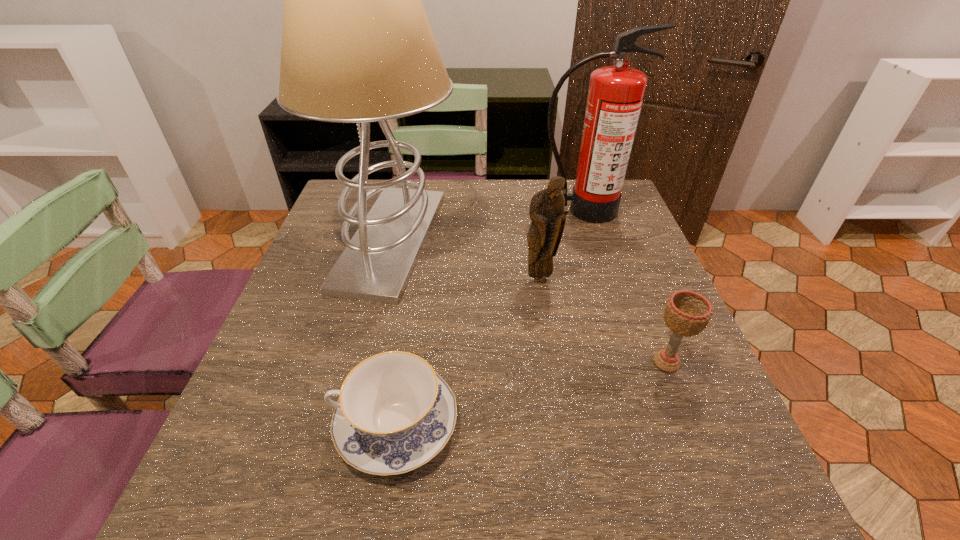
This screenshot has width=960, height=540. I want to click on free space located 0.070m with the handle on the side of the shortest object, so click(291, 424).

I want to click on free space located 0.070m with the handle on the side of the shortest object, so click(291, 424).

Locate an element on the screen. table lamp situated at the far edge is located at coordinates (357, 47).

Identify the location of fire extinguisher that is at the far edge. (615, 96).

This screenshot has width=960, height=540. Identify the location of object at the near edge. (395, 413).

Identify the location of object that is at the left edge. The height and width of the screenshot is (540, 960). (357, 47).

The height and width of the screenshot is (540, 960). I want to click on fire extinguisher that is at the right edge, so click(x=615, y=96).

This screenshot has width=960, height=540. I want to click on chalice that is at the right edge, so click(687, 313).

This screenshot has height=540, width=960. What are the coordinates of `object at the far left corner` in the screenshot? It's located at (357, 47).

The height and width of the screenshot is (540, 960). Find the location of `object situated at the far right corner`. object situated at the far right corner is located at coordinates tap(615, 96).